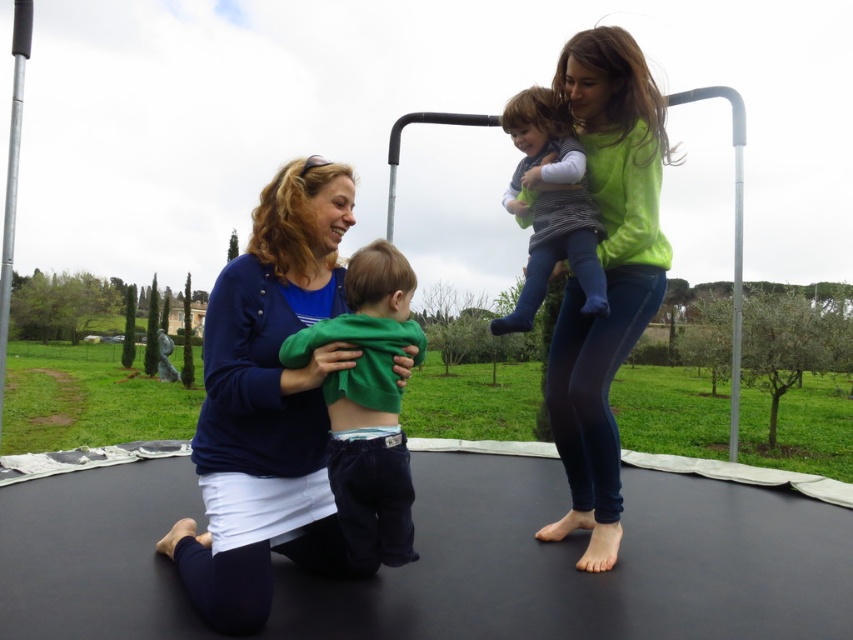
Based on the photo, who is positioned more to the left, green matte sweater at upper right or striped knit sweater at upper center?

striped knit sweater at upper center is more to the left.

Which is in front, point (572, 403) or point (561, 196)?

Positioned in front is point (572, 403).

Who is more forward, [641,170] or [596,314]?

Point [596,314] is more forward.

In order to click on green matte sweater at upper right in this screenshot , I will do `click(606, 273)`.

Does blue fabric at center come in front of green matte hoodie at center?

Yes, it is.

Is blue fabric at center to the left of green matte hoodie at center from the viewer's perspective?

Correct, you'll find blue fabric at center to the left of green matte hoodie at center.

Does point (198, 474) come farther from viewer compared to point (399, 468)?

Yes.

The width and height of the screenshot is (853, 640). Identify the location of blue fabric at center. (268, 404).

Is blue fabric at center behind green matte sweater at upper right?

No, blue fabric at center is in front of green matte sweater at upper right.

Does blue fabric at center appear on the left side of green matte sweater at upper right?

Correct, you'll find blue fabric at center to the left of green matte sweater at upper right.

The image size is (853, 640). I want to click on blue fabric at center, so click(x=268, y=404).